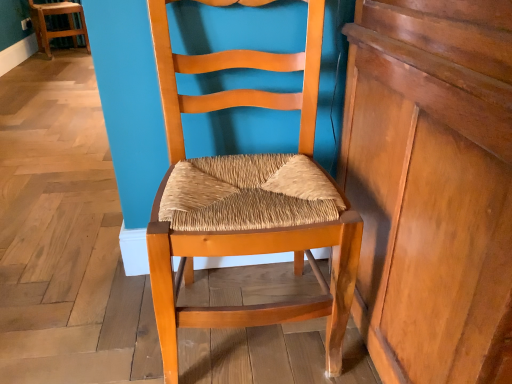
Locate an element on the screen. shiny brown wood dresser at right is located at coordinates (432, 186).

What do you see at coordinates (245, 199) in the screenshot?
I see `wooden woven seat at center, the 1th chair positioned from the right` at bounding box center [245, 199].

Where is `shiny brown wood dresser at right`? The width and height of the screenshot is (512, 384). shiny brown wood dresser at right is located at coordinates (432, 186).

Considering the relative sizes of wooden chair at upper left, which is the first chair from top to bottom, and wooden woven seat at center, which is counted as the second chair, starting from the top, in the image provided, is wooden chair at upper left, which is the first chair from top to bottom, thinner than wooden woven seat at center, which is counted as the second chair, starting from the top,?

No.

Is wooden woven seat at center, the 1th chair positioned from the right, completely or partially inside wooden chair at upper left, the 2th chair positioned from the front?

No, wooden woven seat at center, the 1th chair positioned from the right, is not inside wooden chair at upper left, the 2th chair positioned from the front.

Can you tell me how much wooden chair at upper left, which is the first chair from top to bottom, and wooden woven seat at center, marked as the first chair in a front-to-back arrangement, differ in facing direction?

They differ by 92.7 degrees in their facing directions.

Visually, is wooden chair at upper left, marked as the 1th chair in a left-to-right arrangement, positioned to the left or to the right of wooden woven seat at center, which appears as the 2th chair when viewed from the back?

wooden chair at upper left, marked as the 1th chair in a left-to-right arrangement, is positioned on wooden woven seat at center, which appears as the 2th chair when viewed from the back,'s left side.

Is shiny brown wood dresser at right placed right next to wooden chair at upper left, the 2th chair positioned from the front?

They are not placed beside each other.

From their relative heights in the image, would you say shiny brown wood dresser at right is taller or shorter than wooden chair at upper left, which ranks as the second chair in bottom-to-top order?

Considering their sizes, shiny brown wood dresser at right has more height than wooden chair at upper left, which ranks as the second chair in bottom-to-top order.

Could you tell me if shiny brown wood dresser at right is facing wooden chair at upper left, the 2th chair from the right?

No, shiny brown wood dresser at right does not turn towards wooden chair at upper left, the 2th chair from the right.

Can wooden chair at upper left, which ranks as the second chair in bottom-to-top order, be found inside shiny brown wood dresser at right?

No.

Consider the image. Who is more distant, wooden woven seat at center, marked as the first chair in a front-to-back arrangement, or wooden chair at upper left, the 1th chair in the back-to-front sequence?

wooden chair at upper left, the 1th chair in the back-to-front sequence, is further away from the camera.

The height and width of the screenshot is (384, 512). I want to click on chair below the wooden woven seat at center, the 1th chair positioned from the right (from a real-world perspective), so click(60, 29).

Who is shorter, wooden woven seat at center, the 2th chair from the left, or wooden chair at upper left, the 2th chair positioned from the front?

wooden chair at upper left, the 2th chair positioned from the front.

Based on the photo, does wooden woven seat at center, positioned as the first chair in bottom-to-top order, have a smaller size compared to wooden chair at upper left, marked as the 1th chair in a left-to-right arrangement?

Actually, wooden woven seat at center, positioned as the first chair in bottom-to-top order, might be larger than wooden chair at upper left, marked as the 1th chair in a left-to-right arrangement.

Between wooden chair at upper left, which is the first chair from top to bottom, and shiny brown wood dresser at right, which one has more height?

shiny brown wood dresser at right.

Looking at this image, is wooden chair at upper left, which ranks as the second chair in bottom-to-top order, inside or outside of shiny brown wood dresser at right?

wooden chair at upper left, which ranks as the second chair in bottom-to-top order, lies outside shiny brown wood dresser at right.

Does point (48, 8) come closer to viewer compared to point (352, 166)?

No, it is not.

The width and height of the screenshot is (512, 384). I want to click on dresser located on the right of wooden chair at upper left, the 1th chair in the back-to-front sequence, so click(432, 186).

Considering the positions of objects wooden woven seat at center, which is counted as the second chair, starting from the top, and shiny brown wood dresser at right in the image provided, who is in front, wooden woven seat at center, which is counted as the second chair, starting from the top, or shiny brown wood dresser at right?

shiny brown wood dresser at right.

Are wooden woven seat at center, marked as the first chair in a front-to-back arrangement, and shiny brown wood dresser at right located far from each other?

They are positioned close to each other.

Can you confirm if wooden woven seat at center, which appears as the 2th chair when viewed from the back, is positioned to the right of shiny brown wood dresser at right?

No.

From a real-world perspective, is wooden woven seat at center, which is counted as the second chair, starting from the top, below shiny brown wood dresser at right?

Yes, from a real-world perspective, wooden woven seat at center, which is counted as the second chair, starting from the top, is beneath shiny brown wood dresser at right.

Consider the image. From a real-world perspective, is shiny brown wood dresser at right on wooden woven seat at center, marked as the first chair in a front-to-back arrangement?

Yes.

Considering the relative positions of shiny brown wood dresser at right and wooden woven seat at center, the 2th chair from the left, in the image provided, is shiny brown wood dresser at right to the left of wooden woven seat at center, the 2th chair from the left, from the viewer's perspective?

No.

Is shiny brown wood dresser at right looking in the opposite direction of wooden woven seat at center, positioned as the first chair in bottom-to-top order?

shiny brown wood dresser at right is not turned away from wooden woven seat at center, positioned as the first chair in bottom-to-top order.

Who is shorter, shiny brown wood dresser at right or wooden woven seat at center, the 2th chair from the left?

With less height is wooden woven seat at center, the 2th chair from the left.

This screenshot has width=512, height=384. I want to click on chair above the wooden chair at upper left, marked as the 1th chair in a left-to-right arrangement (from a real-world perspective), so click(245, 199).

At what (x,y) coordinates should I click in order to perform the action: click on the 2nd chair behind the shiny brown wood dresser at right. Please return your answer as a coordinate pair (x, y). The width and height of the screenshot is (512, 384). Looking at the image, I should click on click(60, 29).

Based on their spatial positions, is wooden woven seat at center, the 1th chair positioned from the right, or wooden chair at upper left, the 1th chair in the back-to-front sequence, closer to shiny brown wood dresser at right?

wooden woven seat at center, the 1th chair positioned from the right, lies closer to shiny brown wood dresser at right than the other object.

Based on their spatial positions, is shiny brown wood dresser at right or wooden chair at upper left, the 2th chair from the right, further from wooden woven seat at center, the 1th chair positioned from the right?

wooden chair at upper left, the 2th chair from the right, is positioned further to the anchor wooden woven seat at center, the 1th chair positioned from the right.

Considering their positions, is wooden chair at upper left, which ranks as the second chair in bottom-to-top order, positioned further to shiny brown wood dresser at right than wooden woven seat at center, marked as the first chair in a front-to-back arrangement?

wooden chair at upper left, which ranks as the second chair in bottom-to-top order, is positioned further to the anchor shiny brown wood dresser at right.

From the image, which object appears to be farther from wooden chair at upper left, which is the first chair from top to bottom, shiny brown wood dresser at right or wooden woven seat at center, the 1th chair positioned from the right?

shiny brown wood dresser at right is further to wooden chair at upper left, which is the first chair from top to bottom.

Which object lies further to the anchor point wooden chair at upper left, which is the first chair from top to bottom, wooden woven seat at center, the 1th chair positioned from the right, or shiny brown wood dresser at right?

shiny brown wood dresser at right lies further to wooden chair at upper left, which is the first chair from top to bottom, than the other object.

Estimate the real-world distances between objects in this image. Which object is further from wooden woven seat at center, the 1th chair positioned from the right, wooden chair at upper left, the 2th chair from the right, or shiny brown wood dresser at right?

The object further to wooden woven seat at center, the 1th chair positioned from the right, is wooden chair at upper left, the 2th chair from the right.

Where is `chair between shiny brown wood dresser at right and wooden chair at upper left, which is the first chair from top to bottom, in the front-back direction`? chair between shiny brown wood dresser at right and wooden chair at upper left, which is the first chair from top to bottom, in the front-back direction is located at coordinates (245, 199).